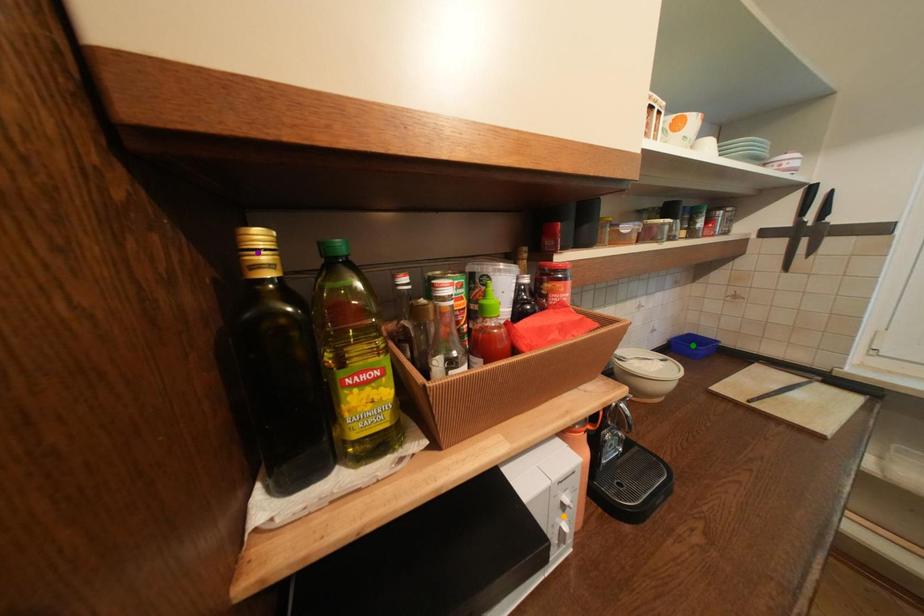
Order these from farthest to nearest:
A) purple point
B) orange point
C) green point

green point
orange point
purple point